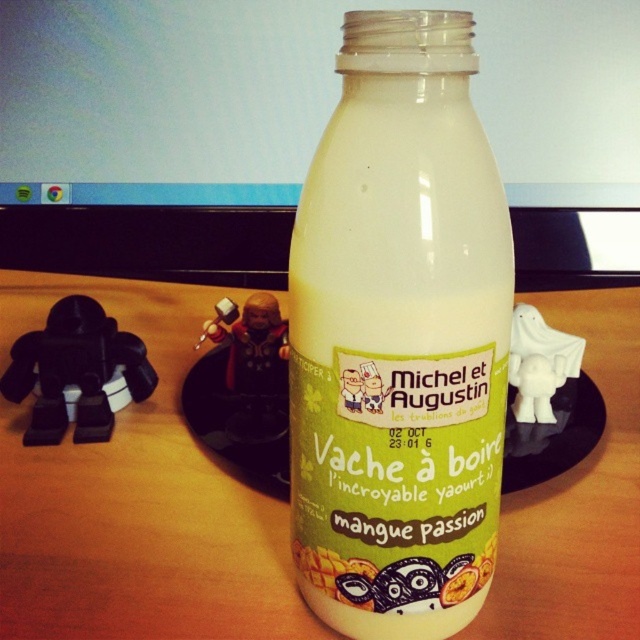
Question: Among these points, which one is farthest from the camera?

Choices:
 (A) (513, 369)
 (B) (344, 392)
 (C) (250, 417)

Answer: (A)

Question: Which object is the farthest from the metallic figure at center?

Choices:
 (A) matte plastic figurine at center
 (B) black plastic toy at left

Answer: (A)

Question: Can you confirm if white matte ghost at upper right is thinner than matte plastic figurine at center?

Choices:
 (A) yes
 (B) no

Answer: (B)

Question: Does white matte bottle at center have a smaller size compared to wooden table at center?

Choices:
 (A) yes
 (B) no

Answer: (A)

Question: Which of the following is the farthest from the observer?

Choices:
 (A) metallic figure at center
 (B) white matte bottle at center

Answer: (A)

Question: Can you confirm if white matte bottle at center is wider than white matte ghost at upper right?

Choices:
 (A) yes
 (B) no

Answer: (A)